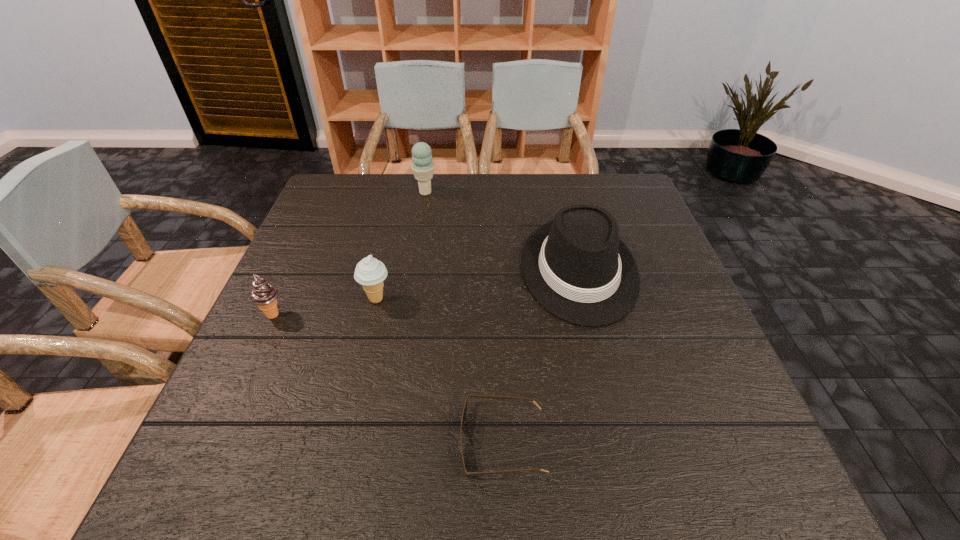
You are a GUI agent. You are given a task and a screenshot of the screen. Output one action in this format:
    pyautogui.click(x=<x>, y=<y>)
    Task: Click on the vacant point located between the fedora and the second object from left to right
    The height and width of the screenshot is (540, 960).
    Given the screenshot: What is the action you would take?
    pyautogui.click(x=478, y=285)

Identify the location of free space between the rightmost icecream and the nearest object. This screenshot has width=960, height=540. (464, 318).

Image resolution: width=960 pixels, height=540 pixels. Find the location of `free space that is in between the second icecream from left to right and the fedora`. free space that is in between the second icecream from left to right and the fedora is located at coordinates (478, 285).

In order to click on vacant space that is in between the leftmost object and the nearest object in this screenshot , I will do `click(388, 379)`.

Locate which object is the third closest to the leftmost icecream. Please provide its 2D coordinates. Your answer should be formatted as a tuple, i.e. [(x, y)], where the tuple contains the x and y coordinates of a point satisfying the conditions above.

[(422, 167)]

Where is `the closest object to the tallest icecream`? The image size is (960, 540). the closest object to the tallest icecream is located at coordinates (576, 266).

Identify which icecream is located as the second nearest to the tallest icecream. Please provide its 2D coordinates. Your answer should be formatted as a tuple, i.e. [(x, y)], where the tuple contains the x and y coordinates of a point satisfying the conditions above.

[(264, 295)]

Select which icecream is the second closest to the leftmost object. Please provide its 2D coordinates. Your answer should be formatted as a tuple, i.e. [(x, y)], where the tuple contains the x and y coordinates of a point satisfying the conditions above.

[(422, 167)]

At what (x,y) coordinates should I click in order to perform the action: click on vacant region that satisfies the following two spatial constraints: 1. on the back side of the second icecream from left to right; 2. on the right side of the leftmost icecream. Please return your answer as a coordinate pair (x, y). Image resolution: width=960 pixels, height=540 pixels. Looking at the image, I should click on (280, 299).